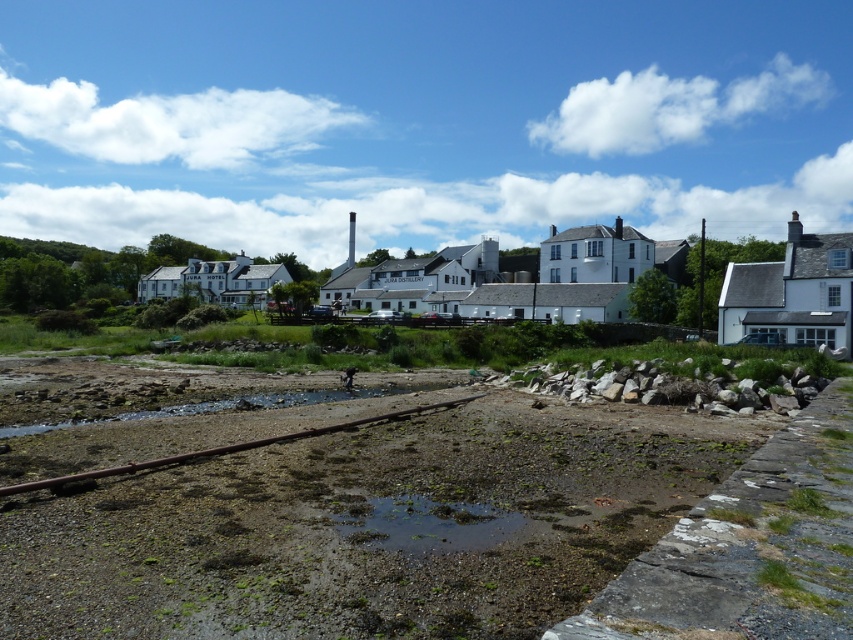
Question: Which of the following is the farthest from the observer?

Choices:
 (A) (386, 416)
 (B) (527, 467)
 (C) (432, 540)

Answer: (A)

Question: Is the position of white matte building at center more distant than that of rusty metal train track at lower center?

Choices:
 (A) no
 (B) yes

Answer: (B)

Question: Can you confirm if green mossy water at center is wider than rusty metal train track at lower center?

Choices:
 (A) no
 (B) yes

Answer: (A)

Question: Which object is farther from the camera taking this photo?

Choices:
 (A) rusty metal train track at lower center
 (B) dull brown mud at lower center
 (C) white matte building at center

Answer: (C)

Question: Which of these objects is positioned closest to the dull brown mud at lower center?

Choices:
 (A) white matte building at center
 (B) rusty metal train track at lower center

Answer: (B)

Question: Is the position of white matte building at center less distant than that of rusty metal train track at lower center?

Choices:
 (A) yes
 (B) no

Answer: (B)